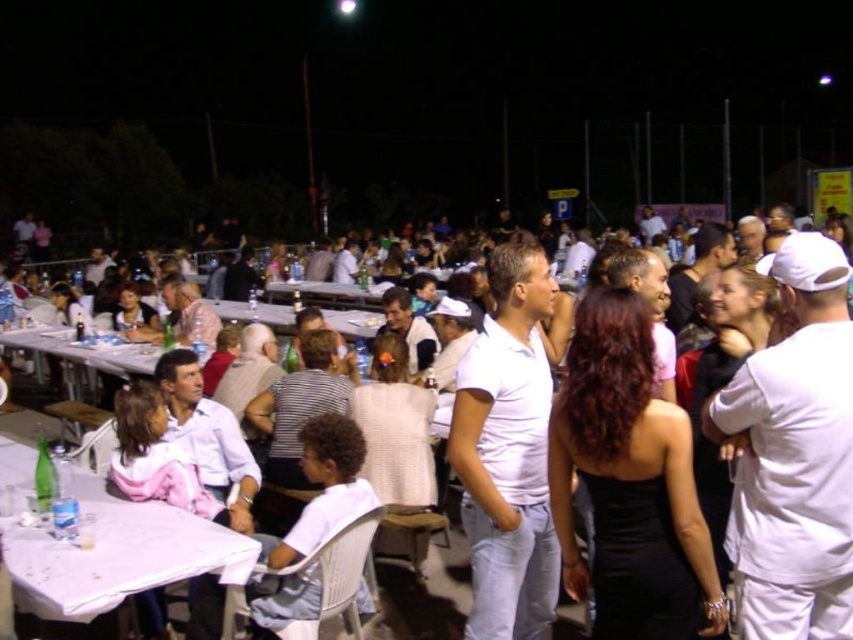
Can you confirm if white plastic table at lower left is positioned above white cotton shirt at center?

Yes.

Between point (1, 438) and point (740, 362), which one is positioned in front?

Point (740, 362) is more forward.

The width and height of the screenshot is (853, 640). Find the location of `white plastic table at lower left`. white plastic table at lower left is located at coordinates (117, 554).

What are the coordinates of `white plastic table at lower left` in the screenshot? It's located at (117, 554).

Who is lower down, white plastic table at lower left or white plastic table at left?

white plastic table at lower left

At what (x,y) coordinates should I click in order to perform the action: click on white plastic table at lower left. Please return your answer as a coordinate pair (x, y). The image size is (853, 640). Looking at the image, I should click on (117, 554).

Identify the location of white plastic table at lower left. (117, 554).

Which is more to the right, white cotton shirt at center or white plastic table at left?

From the viewer's perspective, white cotton shirt at center appears more on the right side.

How much distance is there between white cotton shirt at center and white plastic table at left?

white cotton shirt at center and white plastic table at left are 3.76 meters apart.

Is point (296, 502) closer to camera compared to point (68, 330)?

Yes, point (296, 502) is in front of point (68, 330).

Locate an element on the screen. This screenshot has width=853, height=640. white cotton shirt at center is located at coordinates (706, 440).